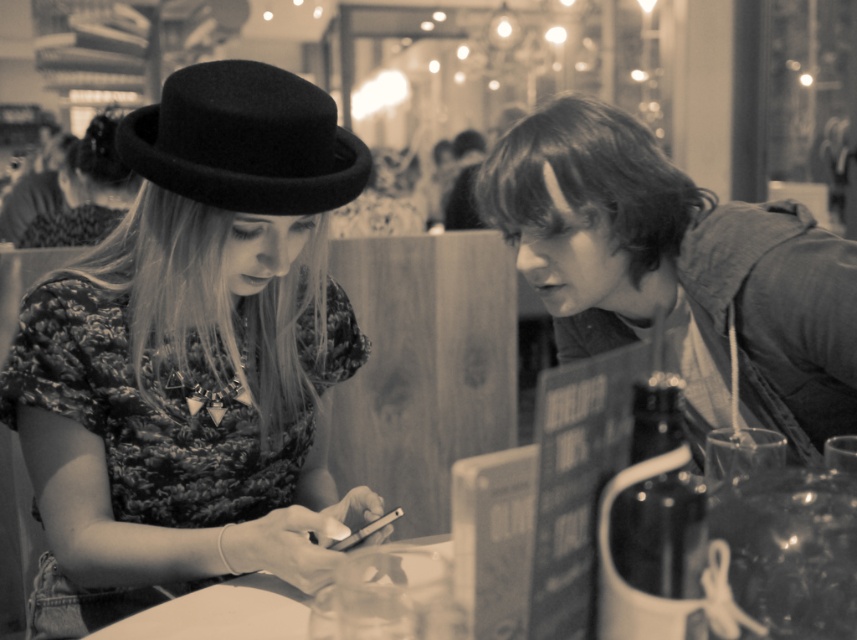
Question: Among these points, which one is nearest to the camera?

Choices:
 (A) coord(213,100)
 (B) coord(232,132)
 (C) coord(160,611)
 (D) coord(94,172)

Answer: (C)

Question: Is matte black hat at left positioned at the back of black felt fedora at upper left?

Choices:
 (A) no
 (B) yes

Answer: (A)

Question: In this image, where is matte black hat at left located relative to white glossy table at center?

Choices:
 (A) left
 (B) right

Answer: (A)

Question: Which is nearer to the matte black hat at upper left?

Choices:
 (A) white glossy table at center
 (B) black felt fedora at upper left

Answer: (B)

Question: Estimate the real-world distances between objects in this image. Which object is farther from the white glossy table at center?

Choices:
 (A) matte black hat at upper left
 (B) black felt fedora at upper left
 (C) matte black hat at left

Answer: (A)

Question: Does matte black hat at upper left have a lesser width compared to white glossy table at center?

Choices:
 (A) yes
 (B) no

Answer: (B)